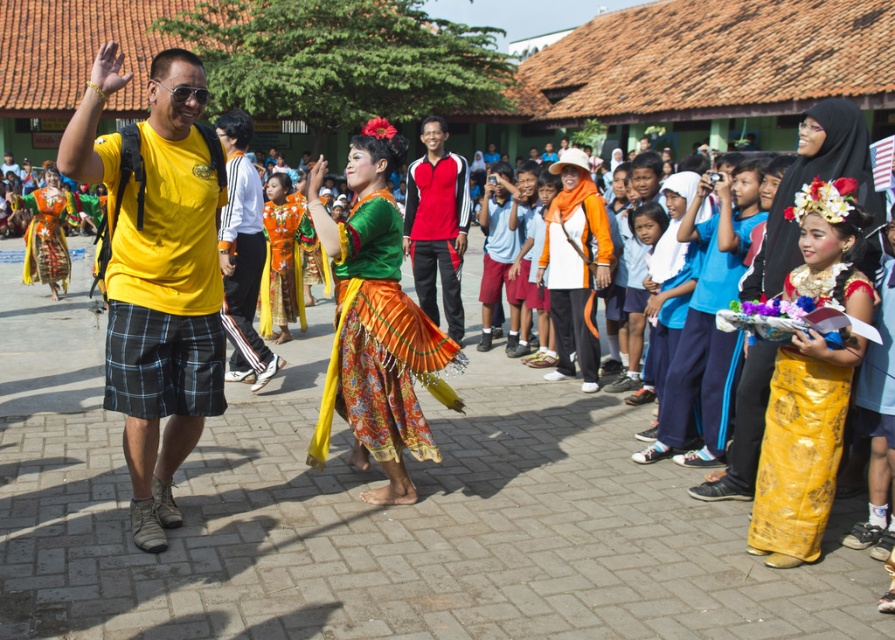
You are standing in the courtyard and want to take a photo of the textured silk skirt at center. Where should you position yourself to capture it in the frame?

To capture the textured silk skirt at center in the frame, position yourself so that the skirt is centered at coordinates approximately 0.506 on the x and 0.420 on the y axis.

You are organizing a photo shoot in the courtyard and need to position two models so that their outfits are clearly visible. The models are wearing the textured silk skirt at center and the red and black sportswear at center. Given their positions and the description, which outfit will require more space to accommodate its width?

The textured silk skirt at center requires more space because its width surpasses that of the red and black sportswear at center.

You are organizing a photo shoot and need to place two props next to the shiny yellow skirt at right and the red and black sportswear at center. If the props must be placed in order from narrowest to widest, which object should come first?

The shiny yellow skirt at right should come first because its width is less than the red and black sportswear at center.